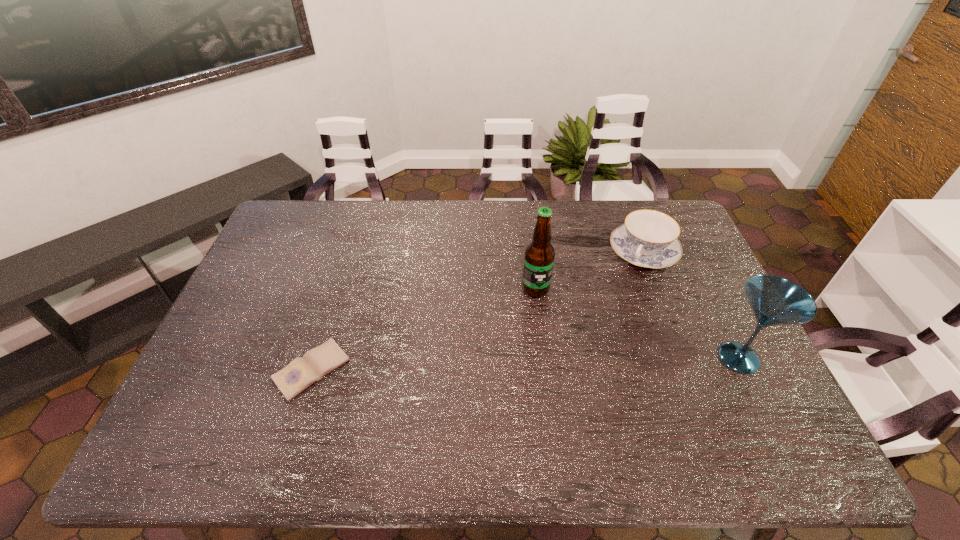
Where is `vacant spot on the desktop that is between the leftmost object and the martini and is positioned with the handle on the side of the farthest object`? The height and width of the screenshot is (540, 960). vacant spot on the desktop that is between the leftmost object and the martini and is positioned with the handle on the side of the farthest object is located at coordinates (590, 362).

Image resolution: width=960 pixels, height=540 pixels. What are the coordinates of `free space on the desktop that is between the shortest object and the martini and is positioned on the label of the third object from right to left` in the screenshot? It's located at (534, 363).